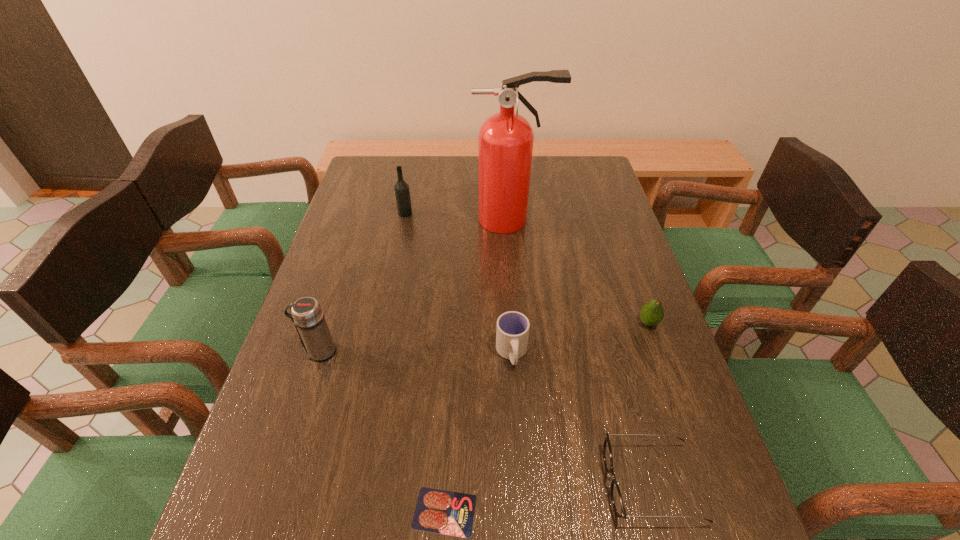
This screenshot has width=960, height=540. What are the coordinates of `vacant space in between the fifth nearest object and the sixth object from right to left` in the screenshot? It's located at (527, 268).

Identify the location of vacant space in between the cup and the fire extinguisher. (512, 286).

The height and width of the screenshot is (540, 960). Find the location of `vacant area between the fire extinguisher and the thermos bottle`. vacant area between the fire extinguisher and the thermos bottle is located at coordinates (416, 286).

Choose which object is the fifth nearest neighbor to the thermos bottle. Please provide its 2D coordinates. Your answer should be formatted as a tuple, i.e. [(x, y)], where the tuple contains the x and y coordinates of a point satisfying the conditions above.

[(616, 497)]

Identify which object is located as the fourth nearest to the second object from left to right. Please provide its 2D coordinates. Your answer should be formatted as a tuple, i.e. [(x, y)], where the tuple contains the x and y coordinates of a point satisfying the conditions above.

[(652, 313)]